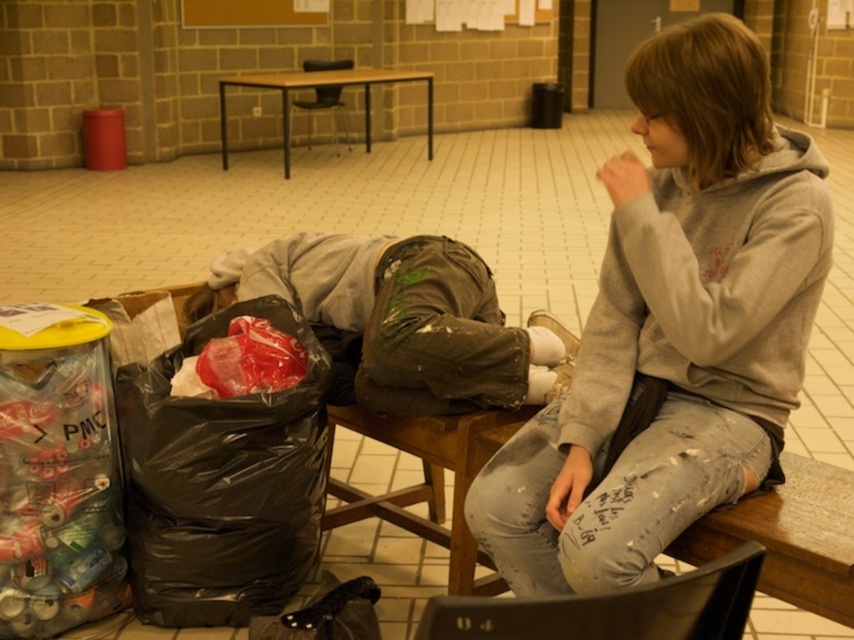
Question: Can you confirm if black plastic bag at lower left is thinner than black plastic chair at lower center?

Choices:
 (A) yes
 (B) no

Answer: (B)

Question: Which object appears closest to the camera in this image?

Choices:
 (A) wooden table at center
 (B) black plastic bag at lower left
 (C) translucent plastic can at left
 (D) matte black chair at center

Answer: (C)

Question: Among these points, which one is nearest to the camera?

Choices:
 (A) (724, 621)
 (B) (736, 355)
 (C) (285, 74)
 (D) (309, 112)

Answer: (A)

Question: From the image, what is the correct spatial relationship of translucent plastic can at left in relation to matte black chair at center?

Choices:
 (A) right
 (B) left

Answer: (A)

Question: Which point is farther from the camera taking this photo?

Choices:
 (A) (548, 444)
 (B) (92, 538)
 (C) (410, 252)

Answer: (C)

Question: Is gray sweatshirt at upper right thinner than black plastic bag at lower left?

Choices:
 (A) no
 (B) yes

Answer: (A)